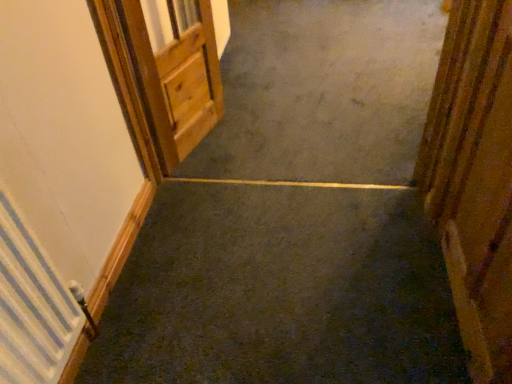
Question: Is wooden door at upper left, arranged as the 1th door when viewed from the left, bigger or smaller than white textured radiator at left?

Choices:
 (A) small
 (B) big

Answer: (B)

Question: From the image's perspective, is wooden door at upper left, arranged as the 1th door when viewed from the left, positioned above or below white textured radiator at left?

Choices:
 (A) below
 (B) above

Answer: (B)

Question: Which is nearer to the wooden door at right, marked as the first door in a right-to-left arrangement?

Choices:
 (A) white textured radiator at left
 (B) wooden door at upper left, marked as the first door in a back-to-front arrangement
 (C) smooth concrete at center

Answer: (C)

Question: Based on their relative distances, which object is nearer to the wooden door at right, marked as the first door in a right-to-left arrangement?

Choices:
 (A) wooden door at upper left, placed as the 2th door when sorted from front to back
 (B) smooth concrete at center
 (C) white textured radiator at left

Answer: (B)